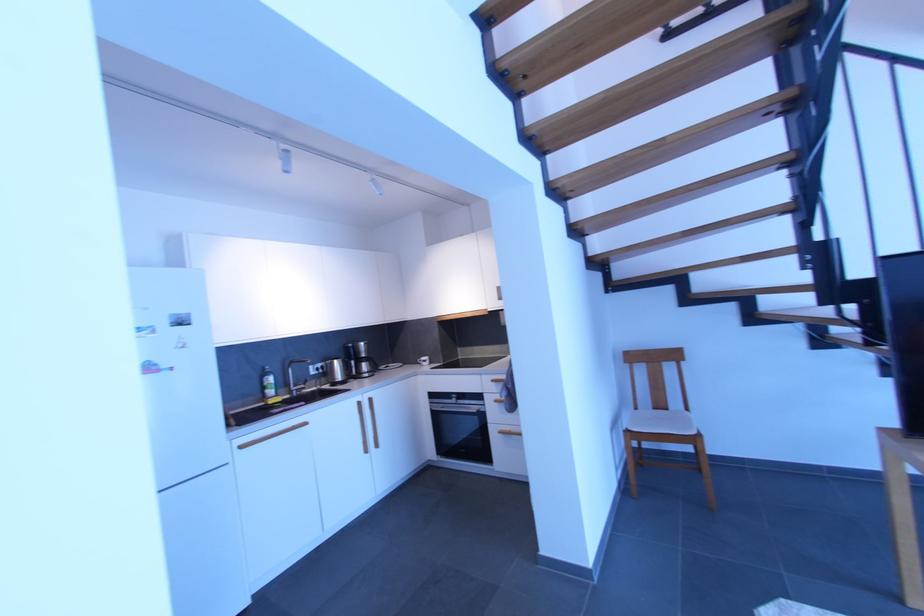
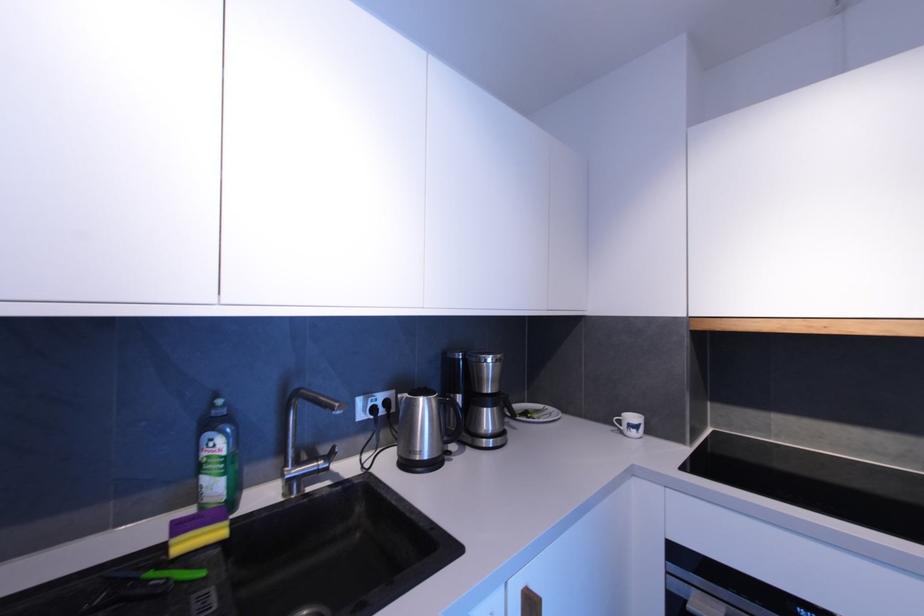
Locate, in the second image, the point that corresponds to pixel 297 363 in the first image.

(301, 395)